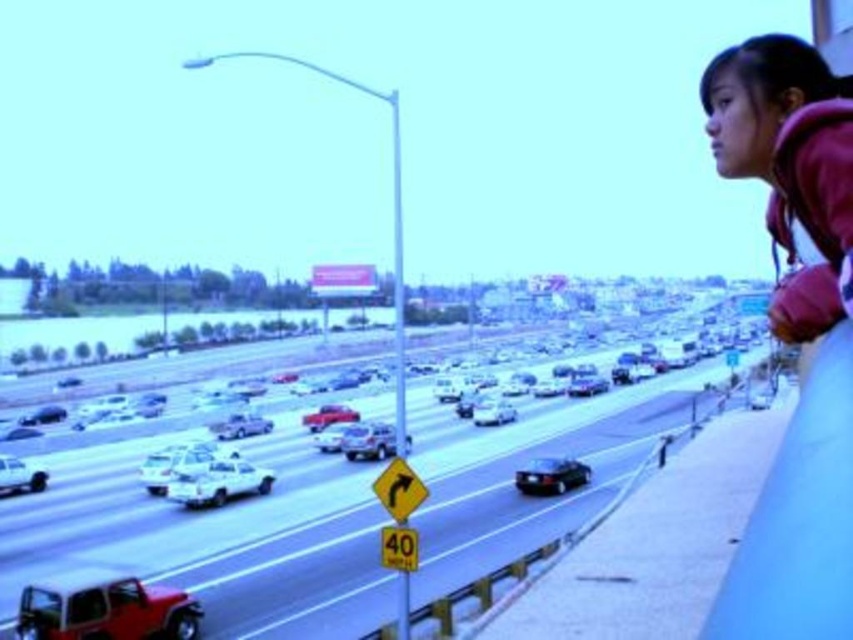
Question: Does metallic silver cars at center appear under matte red jeep at lower left?

Choices:
 (A) yes
 (B) no

Answer: (A)

Question: Which object appears closest to the camera in this image?

Choices:
 (A) matte red jeep at lower left
 (B) white glossy sedan at lower left
 (C) white matte sedan at lower left

Answer: (A)

Question: Which point is farther from the camera taking this photo?

Choices:
 (A) (20, 458)
 (B) (165, 588)
 (C) (556, 458)

Answer: (A)

Question: Can you confirm if shiny black sedan at center is positioned to the right of white glossy sedan at lower left?

Choices:
 (A) yes
 (B) no

Answer: (A)

Question: Among these points, which one is farthest from the camera?

Choices:
 (A) (123, 580)
 (B) (242, 486)
 (C) (567, 461)

Answer: (C)

Question: Can you confirm if metallic silver cars at center is bigger than shiny black sedan at center?

Choices:
 (A) no
 (B) yes

Answer: (B)